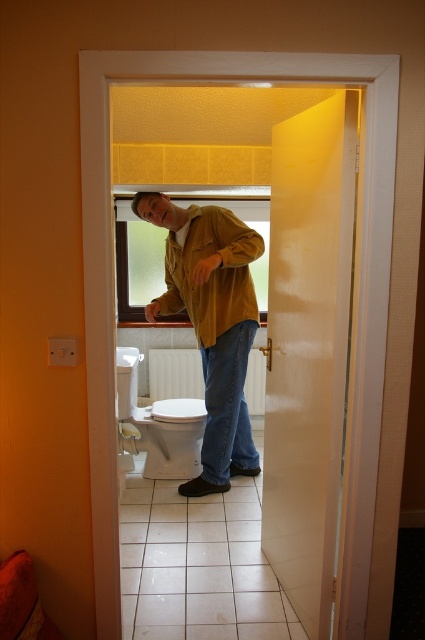
Can you confirm if matte yellow jacket at center is positioned to the left of white glossy toilet bowl at center?

No, matte yellow jacket at center is not to the left of white glossy toilet bowl at center.

Which is in front, point (192, 253) or point (178, 452)?

Point (192, 253) is in front.

Where is `matte yellow jacket at center`? matte yellow jacket at center is located at coordinates (212, 323).